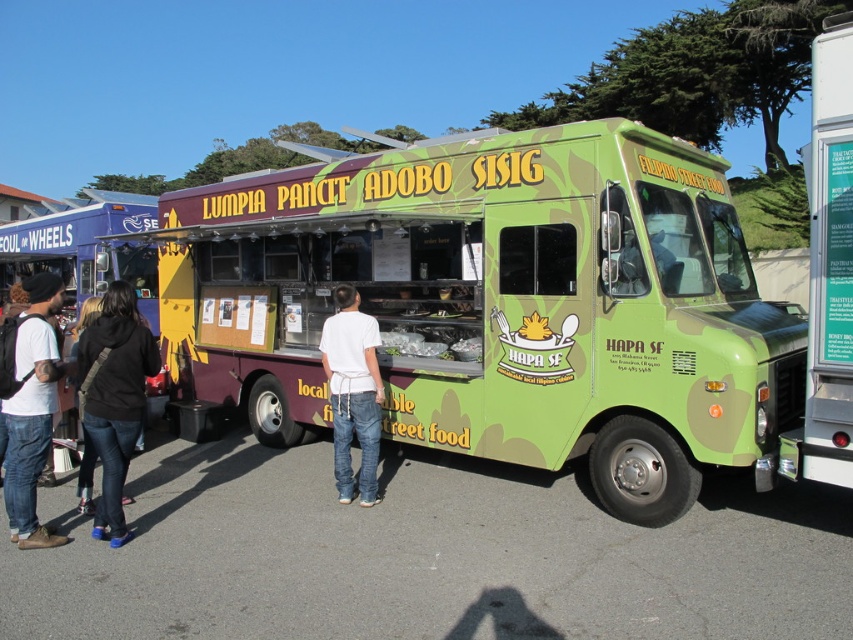
Question: Observing the image, what is the correct spatial positioning of green matte food truck at center in reference to black denim jeans at lower left?

Choices:
 (A) right
 (B) left

Answer: (A)

Question: Which point is closer to the camera?

Choices:
 (A) (367, 404)
 (B) (354, 221)
 (C) (128, 348)

Answer: (C)

Question: Among these points, which one is farthest from the camera?

Choices:
 (A) (334, 406)
 (B) (7, 492)

Answer: (A)

Question: Does green matte food truck at center come behind black denim jeans at lower left?

Choices:
 (A) yes
 (B) no

Answer: (A)

Question: Considering the real-world distances, which object is farthest from the green asphalt at lower center?

Choices:
 (A) white cotton shirt at center
 (B) white t-shirt at left
 (C) green matte food truck at center

Answer: (B)

Question: Does green matte food truck at center have a lesser width compared to black denim jeans at lower left?

Choices:
 (A) no
 (B) yes

Answer: (B)